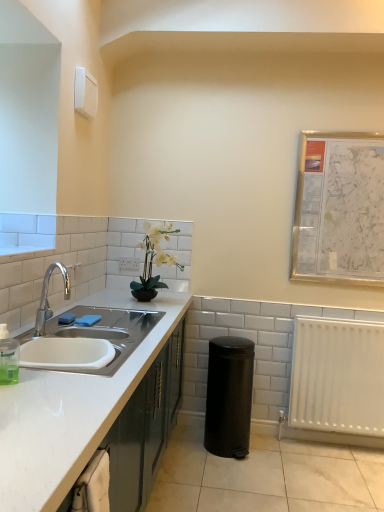
Where is `vacant area on the back side of translucent plastic soap dispenser at sink left`? Image resolution: width=384 pixels, height=512 pixels. vacant area on the back side of translucent plastic soap dispenser at sink left is located at coordinates (42, 364).